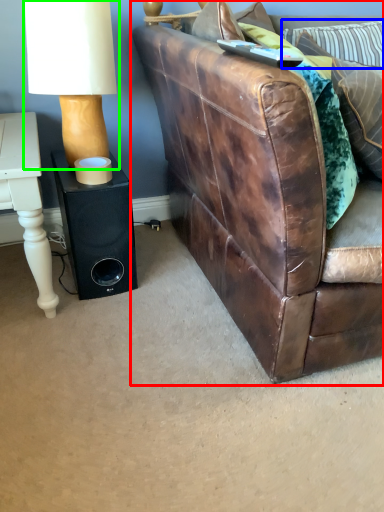
Question: Considering the real-world distances, which object is closest to studio couch (highlighted by a red box)? pillow (highlighted by a blue box) or table lamp (highlighted by a green box).

Choices:
 (A) pillow
 (B) table lamp

Answer: (B)